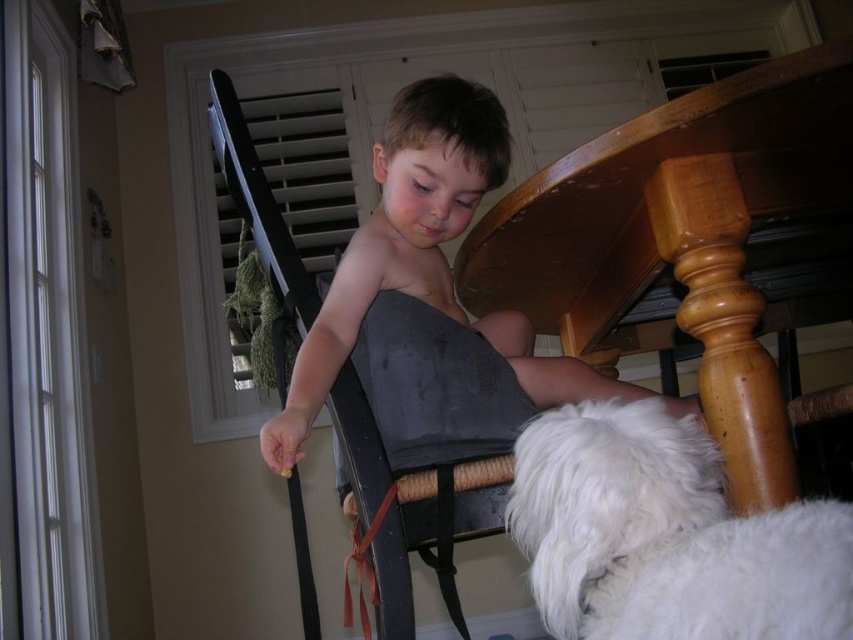
Question: Can you confirm if wooden chair at center is positioned to the left of red fabric strap at lower center?

Choices:
 (A) yes
 (B) no

Answer: (A)

Question: In this image, where is wooden chair at center located relative to red fabric strap at lower center?

Choices:
 (A) left
 (B) right

Answer: (A)

Question: Which point appears farthest from the camera in this image?

Choices:
 (A) (598, 609)
 (B) (415, 376)
 (C) (374, 589)

Answer: (B)

Question: Which point is closer to the camera?

Choices:
 (A) red fabric strap at lower center
 (B) white fluffy dog at lower right

Answer: (B)

Question: Which is farther from the wooden chair at center?

Choices:
 (A) white fluffy dog at lower right
 (B) red fabric strap at lower center

Answer: (A)

Question: Does white fluffy dog at lower right have a larger size compared to red fabric strap at lower center?

Choices:
 (A) yes
 (B) no

Answer: (B)